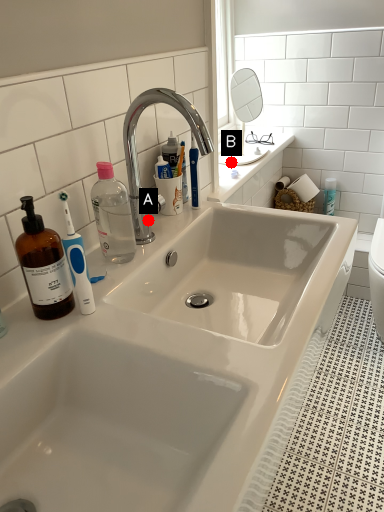
Question: Two points are circled on the image, labeled by A and B beside each circle. Which point is farther to the camera?

Choices:
 (A) A is further
 (B) B is further

Answer: (B)